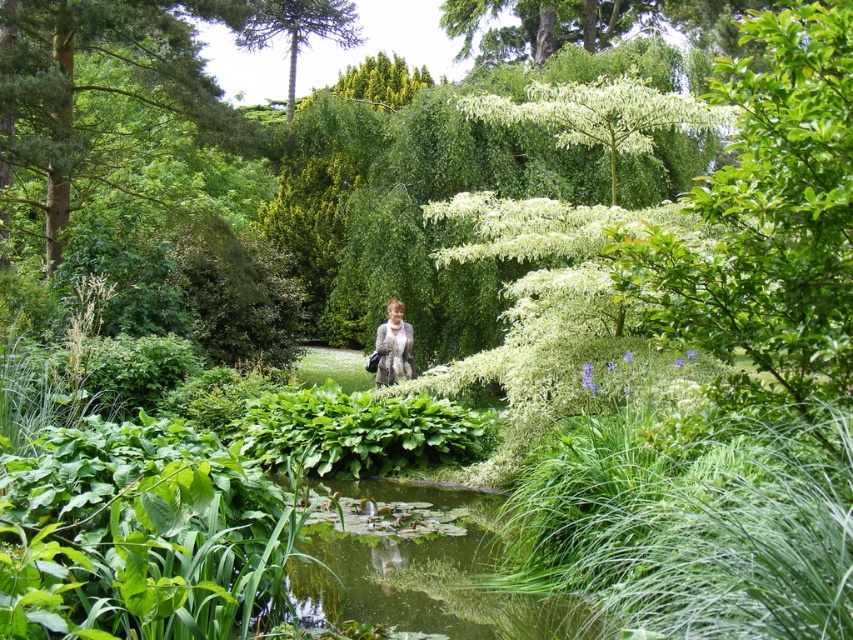
Looking at this image, you are standing in the garden and want to reach the green mossy pond at center from the light gray fur coat at center. Which direction should you move?

The green mossy pond at center is to the right of the light gray fur coat at center, so you should move to the right to reach it.

You are a gardener standing at the edge of the garden. You need to cross from the green mossy pond at center to the light gray fur coat at center. Can you walk directly between them without stepping on any plants?

The green mossy pond at center is in front of the light gray fur coat at center, so you cannot walk directly between them without stepping on the plants in between.

You are a gardener who wants to place a new decorative statue in the garden. The statue is the same size as the light gray fur coat at center. Can you fit it in the green mossy pond at center without overcrowding it?

The green mossy pond at center is larger in size than the light gray fur coat at center, so the statue can be placed there without overcrowding since the pond is bigger than the statue.